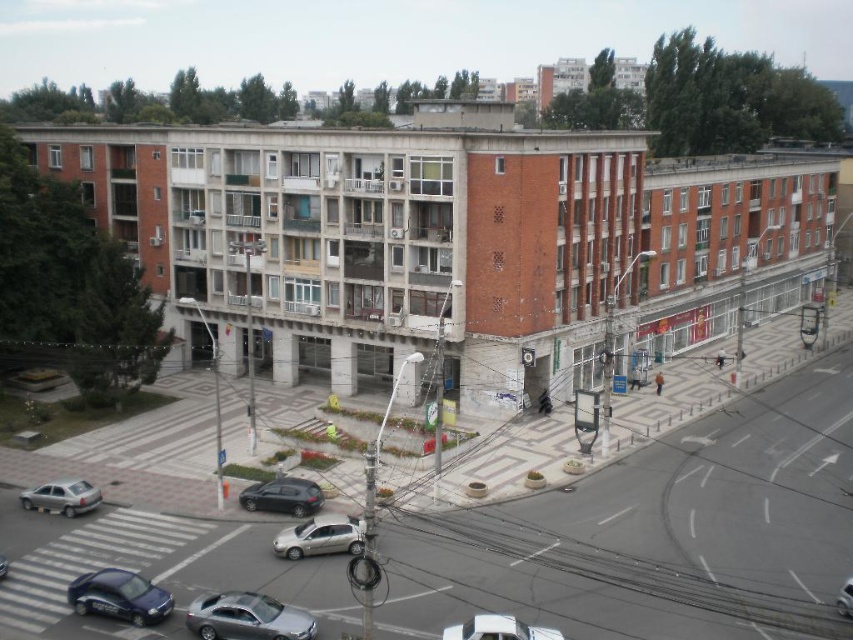
Question: Is sleek silver sedan at lower center positioned before metallic silver car at center?

Choices:
 (A) yes
 (B) no

Answer: (A)

Question: Is silver metallic car at center to the right of matte silver sedan at lower left from the viewer's perspective?

Choices:
 (A) no
 (B) yes

Answer: (B)

Question: Which of the following is the closest to the observer?

Choices:
 (A) satin black car at lower center
 (B) sleek silver sedan at lower center
 (C) silver metallic car at lower center

Answer: (B)

Question: Which point is farther to the camera?

Choices:
 (A) (90, 593)
 (B) (848, 586)

Answer: (B)

Question: Where is satin black car at lower center located in relation to matte silver sedan at lower left in the image?

Choices:
 (A) left
 (B) right

Answer: (B)

Question: Which of the following is the closest to the observer?

Choices:
 (A) silver metallic car at center
 (B) satin black car at lower center
 (C) metallic silver car at center
 (D) matte silver sedan at lower left

Answer: (A)